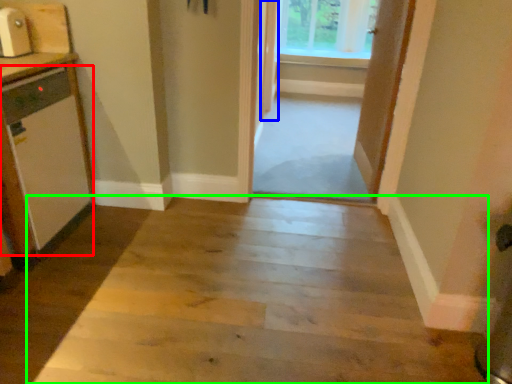
Question: Which is farther away from appliance (highlighted by a red box)? door (highlighted by a blue box) or path (highlighted by a green box)?

Choices:
 (A) door
 (B) path

Answer: (A)